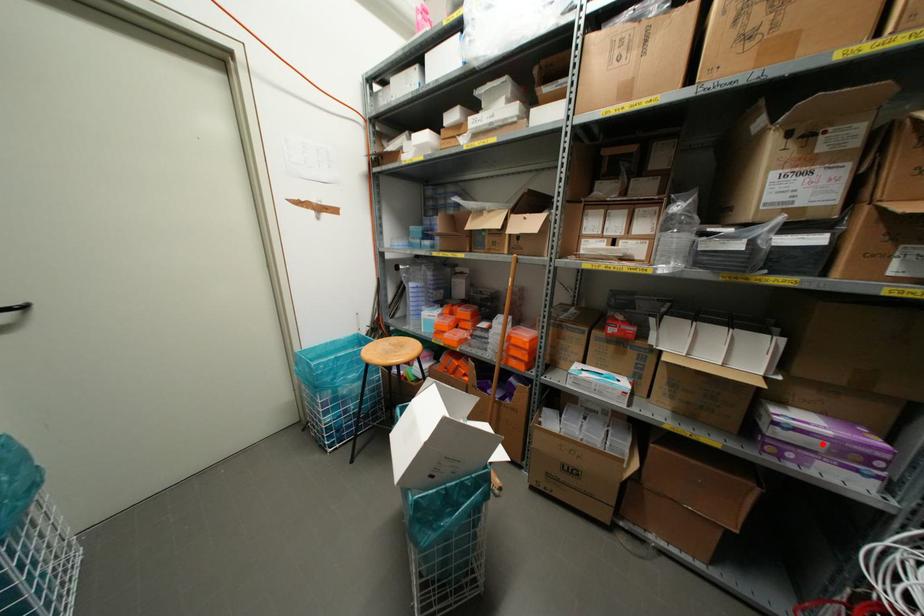
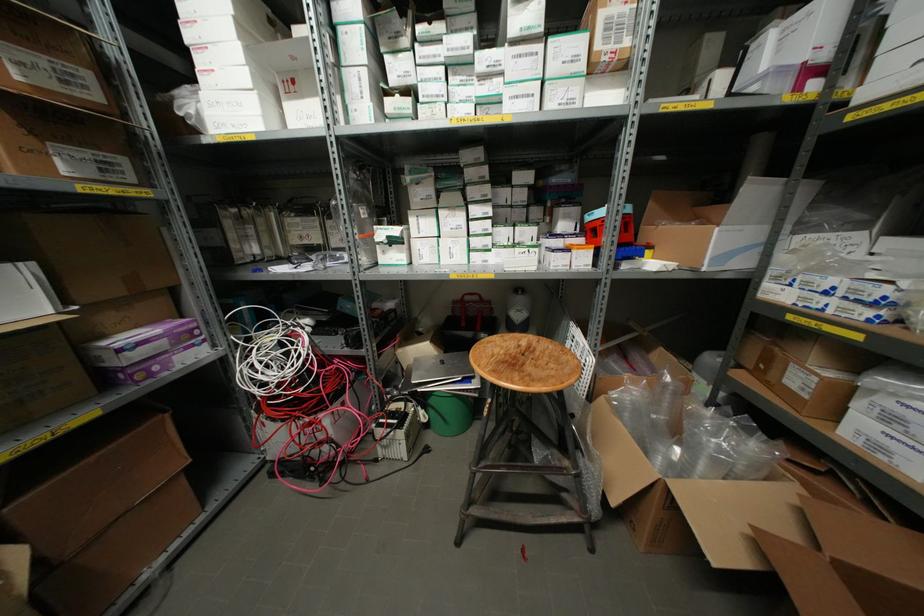
In the second image, find the point that corresponds to the highlighted location in the first image.

(163, 342)